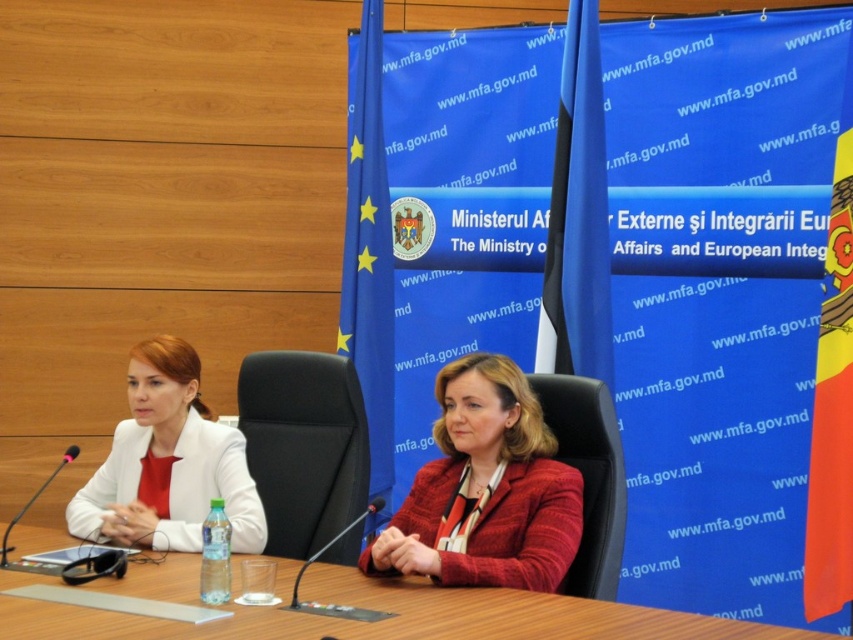
Question: Does wooden table at center lie in front of matte red blazer at center?

Choices:
 (A) yes
 (B) no

Answer: (A)

Question: Is matte red blazer at center positioned before matte white blazer at left?

Choices:
 (A) no
 (B) yes

Answer: (B)

Question: Which point is farther from the camera taking this photo?

Choices:
 (A) (225, 465)
 (B) (534, 417)
 (C) (70, 634)

Answer: (A)

Question: Which of the following is the farthest from the observer?

Choices:
 (A) matte red blazer at center
 (B) wooden table at center
 (C) matte white blazer at left

Answer: (C)

Question: Based on their relative distances, which object is nearer to the matte white blazer at left?

Choices:
 (A) matte red blazer at center
 (B) wooden table at center

Answer: (B)

Question: Can you confirm if wooden table at center is positioned below matte red blazer at center?

Choices:
 (A) no
 (B) yes

Answer: (B)